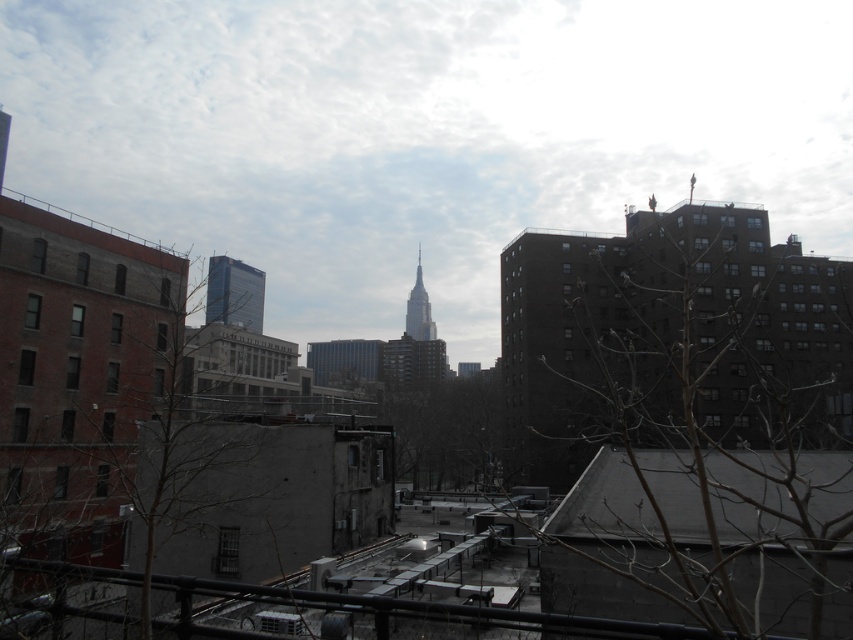
Which is more to the left, smooth glass skyscraper at center or smooth glass spire at center?

smooth glass skyscraper at center

Which of these two, smooth glass skyscraper at center or smooth glass spire at center, stands taller?

Standing taller between the two is smooth glass spire at center.

Describe the element at coordinates (234, 292) in the screenshot. I see `smooth glass skyscraper at center` at that location.

Where is `smooth glass skyscraper at center`? smooth glass skyscraper at center is located at coordinates (234, 292).